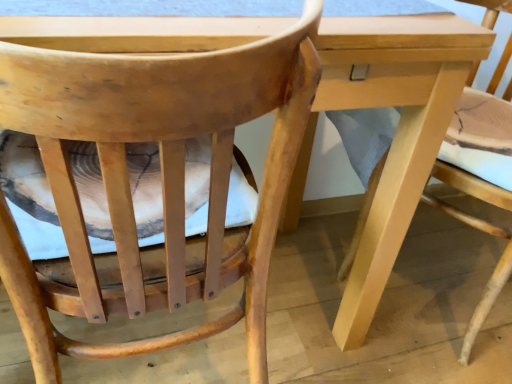
Question: Should I look upward or downward to see natural wood chair at center, placed as the 1th chair when sorted from right to left?

Choices:
 (A) up
 (B) down

Answer: (A)

Question: Can we say natural wood chair at center, placed as the 1th chair when sorted from right to left, lies outside wooden chair at center, which is counted as the first chair, starting from the left?

Choices:
 (A) no
 (B) yes

Answer: (B)

Question: From the image's perspective, is natural wood chair at center, placed as the 1th chair when sorted from right to left, on wooden chair at center, which ranks as the 2th chair in right-to-left order?

Choices:
 (A) no
 (B) yes

Answer: (B)

Question: Considering the relative positions of natural wood chair at center, positioned as the 2th chair in left-to-right order, and wooden chair at center, which ranks as the 2th chair in right-to-left order, in the image provided, is natural wood chair at center, positioned as the 2th chair in left-to-right order, to the left of wooden chair at center, which ranks as the 2th chair in right-to-left order, from the viewer's perspective?

Choices:
 (A) yes
 (B) no

Answer: (B)

Question: Are natural wood chair at center, placed as the 1th chair when sorted from right to left, and wooden chair at center, which is counted as the first chair, starting from the left, far apart?

Choices:
 (A) yes
 (B) no

Answer: (B)

Question: From a real-world perspective, is natural wood chair at center, placed as the 1th chair when sorted from right to left, over wooden chair at center, which ranks as the 2th chair in right-to-left order?

Choices:
 (A) no
 (B) yes

Answer: (A)

Question: Can you confirm if natural wood chair at center, placed as the 1th chair when sorted from right to left, is wider than wooden chair at center, which is counted as the first chair, starting from the left?

Choices:
 (A) no
 (B) yes

Answer: (B)

Question: Is the depth of wooden chair at center, which ranks as the 2th chair in right-to-left order, less than that of natural wood chair at center, placed as the 1th chair when sorted from right to left?

Choices:
 (A) no
 (B) yes

Answer: (B)

Question: From a real-world perspective, does wooden chair at center, which ranks as the 2th chair in right-to-left order, sit lower than natural wood chair at center, placed as the 1th chair when sorted from right to left?

Choices:
 (A) yes
 (B) no

Answer: (B)

Question: Is wooden chair at center, which ranks as the 2th chair in right-to-left order, completely or partially outside of natural wood chair at center, positioned as the 2th chair in left-to-right order?

Choices:
 (A) yes
 (B) no

Answer: (A)

Question: Is wooden chair at center, which ranks as the 2th chair in right-to-left order, further to camera compared to natural wood chair at center, positioned as the 2th chair in left-to-right order?

Choices:
 (A) no
 (B) yes

Answer: (A)

Question: Is wooden chair at center, which ranks as the 2th chair in right-to-left order, not near natural wood chair at center, positioned as the 2th chair in left-to-right order?

Choices:
 (A) no
 (B) yes

Answer: (A)

Question: Considering the relative sizes of wooden chair at center, which is counted as the first chair, starting from the left, and natural wood chair at center, placed as the 1th chair when sorted from right to left, in the image provided, is wooden chair at center, which is counted as the first chair, starting from the left, wider than natural wood chair at center, placed as the 1th chair when sorted from right to left,?

Choices:
 (A) no
 (B) yes

Answer: (A)

Question: Visually, is natural wood chair at center, placed as the 1th chair when sorted from right to left, positioned to the left or to the right of wooden chair at center, which is counted as the first chair, starting from the left?

Choices:
 (A) left
 (B) right

Answer: (B)